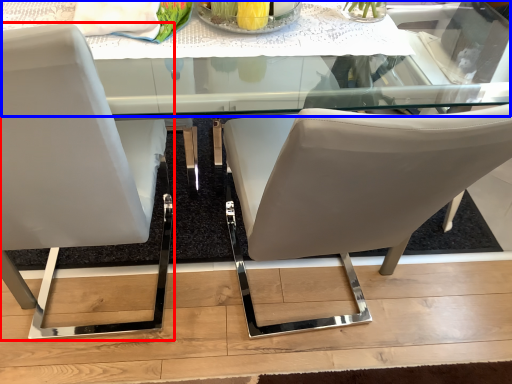
Question: Which point is further to the camera, chair (highlighted by a red box) or round table (highlighted by a blue box)?

Choices:
 (A) chair
 (B) round table

Answer: (B)